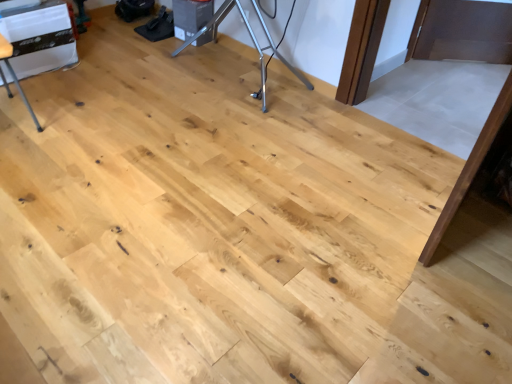
The width and height of the screenshot is (512, 384). I want to click on free space to the right of white plastic table at upper left, so click(x=99, y=66).